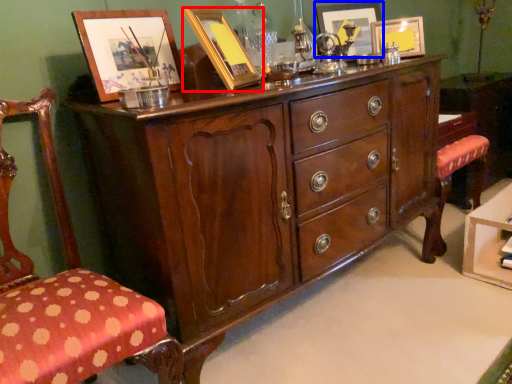
Question: Which point is closer to the camera, picture frame (highlighted by a red box) or picture frame (highlighted by a blue box)?

Choices:
 (A) picture frame
 (B) picture frame

Answer: (A)